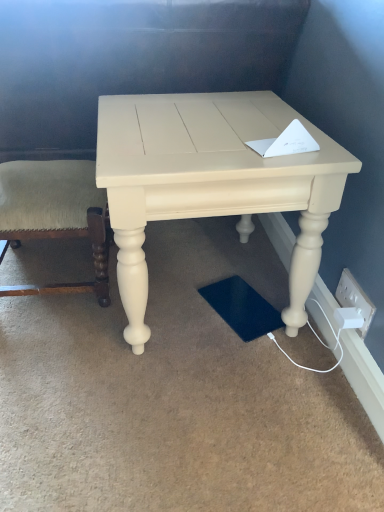
Question: Would you say green fabric cushion at left is a long distance from matte cream table at center?

Choices:
 (A) no
 (B) yes

Answer: (A)

Question: Does green fabric cushion at left have a lesser height compared to matte cream table at center?

Choices:
 (A) no
 (B) yes

Answer: (B)

Question: Is green fabric cushion at left positioned with its back to matte cream table at center?

Choices:
 (A) no
 (B) yes

Answer: (B)

Question: Is matte cream table at center completely or partially inside green fabric cushion at left?

Choices:
 (A) no
 (B) yes

Answer: (A)

Question: Is green fabric cushion at left outside of matte cream table at center?

Choices:
 (A) yes
 (B) no

Answer: (A)

Question: From a real-world perspective, does green fabric cushion at left stand above matte cream table at center?

Choices:
 (A) yes
 (B) no

Answer: (B)

Question: Is matte cream table at center far from white plastic electric outlet at lower right?

Choices:
 (A) no
 (B) yes

Answer: (A)

Question: Is matte cream table at center located outside white plastic electric outlet at lower right?

Choices:
 (A) no
 (B) yes

Answer: (B)

Question: Is matte cream table at center next to white plastic electric outlet at lower right?

Choices:
 (A) yes
 (B) no

Answer: (B)

Question: Can you confirm if matte cream table at center is smaller than white plastic electric outlet at lower right?

Choices:
 (A) yes
 (B) no

Answer: (B)

Question: From a real-world perspective, is matte cream table at center located beneath white plastic electric outlet at lower right?

Choices:
 (A) no
 (B) yes

Answer: (A)

Question: Can you confirm if matte cream table at center is thinner than white plastic electric outlet at lower right?

Choices:
 (A) no
 (B) yes

Answer: (A)

Question: Does white plastic electric outlet at lower right have a lesser height compared to matte cream table at center?

Choices:
 (A) no
 (B) yes

Answer: (B)